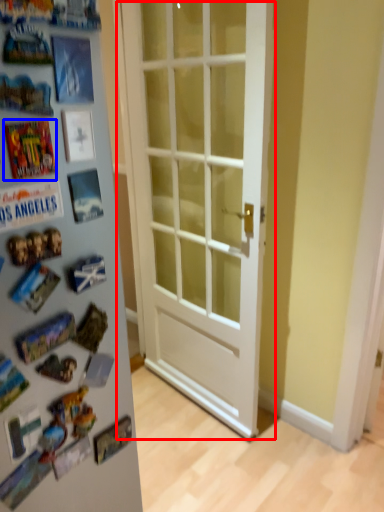
Question: Which object appears closest to the camera in this image, door (highlighted by a red box) or comic book (highlighted by a blue box)?

Choices:
 (A) door
 (B) comic book

Answer: (B)